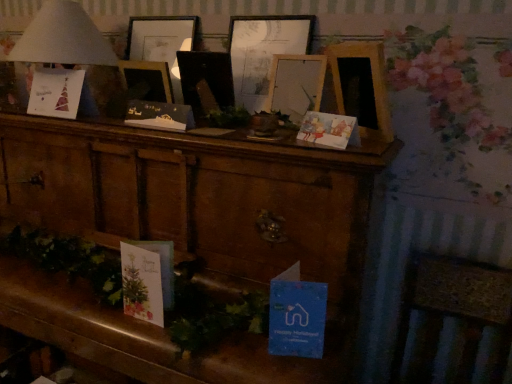
Question: Can you confirm if matte black card at center, arranged as the second christmas card when viewed from the left, is wider than wooden picture frame at center, which ranks as the 3th picture frame in right-to-left order?

Choices:
 (A) yes
 (B) no

Answer: (B)

Question: Is matte black card at center, which appears as the second christmas card when viewed from the back, placed right next to wooden picture frame at center, placed as the 1th picture frame when sorted from left to right?

Choices:
 (A) yes
 (B) no

Answer: (B)

Question: From the image's perspective, is matte black card at center, arranged as the second christmas card when viewed from the left, under wooden picture frame at center, which ranks as the 3th picture frame in right-to-left order?

Choices:
 (A) yes
 (B) no

Answer: (A)

Question: Is matte black card at center, arranged as the second christmas card when viewed from the front, far away from wooden picture frame at center, placed as the 1th picture frame when sorted from left to right?

Choices:
 (A) yes
 (B) no

Answer: (B)

Question: Is matte black card at center, arranged as the second christmas card when viewed from the front, oriented towards wooden picture frame at center, placed as the 1th picture frame when sorted from left to right?

Choices:
 (A) yes
 (B) no

Answer: (B)

Question: From the image's perspective, is matte paper card at center right, placed as the third christmas card when sorted from left to right, positioned above or below white paper lampshade at upper left?

Choices:
 (A) above
 (B) below

Answer: (B)

Question: Is matte paper card at center right, the 1th christmas card when ordered from right to left, in front of or behind white paper lampshade at upper left in the image?

Choices:
 (A) front
 (B) behind

Answer: (A)

Question: Considering the positions of matte paper card at center right, placed as the third christmas card when sorted from back to front, and white paper lampshade at upper left in the image, is matte paper card at center right, placed as the third christmas card when sorted from back to front, taller or shorter than white paper lampshade at upper left?

Choices:
 (A) short
 (B) tall

Answer: (A)

Question: Visually, is matte paper card at center right, the 1th christmas card when ordered from right to left, positioned to the left or to the right of white paper lampshade at upper left?

Choices:
 (A) right
 (B) left

Answer: (A)

Question: Is matte paper card at upper left, acting as the third christmas card starting from the right, spatially inside wooden cabinet at center, or outside of it?

Choices:
 (A) inside
 (B) outside

Answer: (B)

Question: In terms of width, does matte paper card at upper left, arranged as the 3th christmas card when viewed from the front, look wider or thinner when compared to wooden cabinet at center?

Choices:
 (A) wide
 (B) thin

Answer: (B)

Question: Would you say matte paper card at upper left, which is the first christmas card in left-to-right order, is to the left or to the right of wooden cabinet at center in the picture?

Choices:
 (A) right
 (B) left

Answer: (B)

Question: From the image's perspective, is matte paper card at upper left, which is the 1th christmas card from back to front, positioned above or below wooden cabinet at center?

Choices:
 (A) above
 (B) below

Answer: (A)

Question: Is wooden picture frame at center, which ranks as the 3th picture frame in right-to-left order, bigger or smaller than wooden cabinet at center?

Choices:
 (A) small
 (B) big

Answer: (A)

Question: From a real-world perspective, relative to wooden cabinet at center, is wooden picture frame at center, placed as the 1th picture frame when sorted from left to right, vertically above or below?

Choices:
 (A) above
 (B) below

Answer: (A)